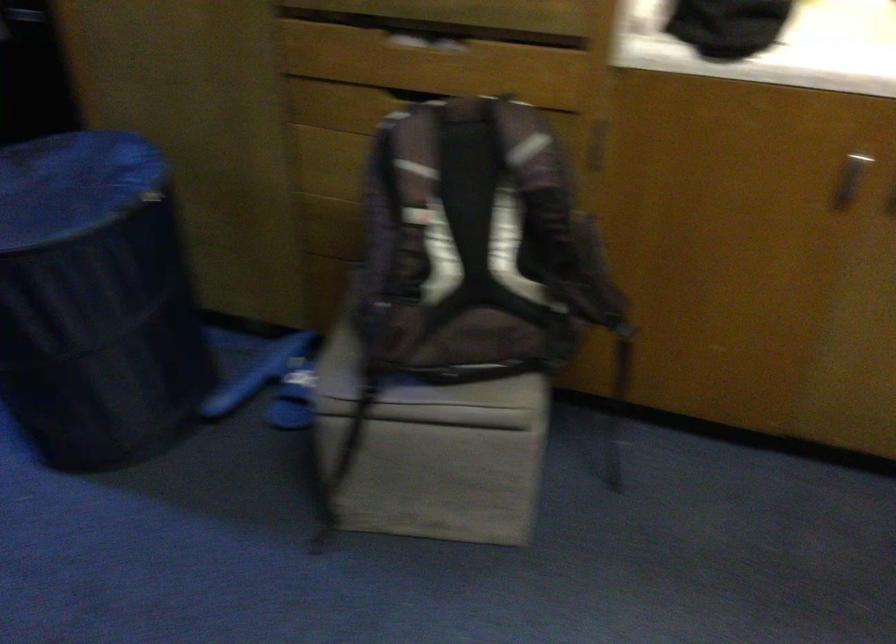
First-person continuous shooting, in which direction is the camera rotating?

The rotation direction of the camera is right-down.